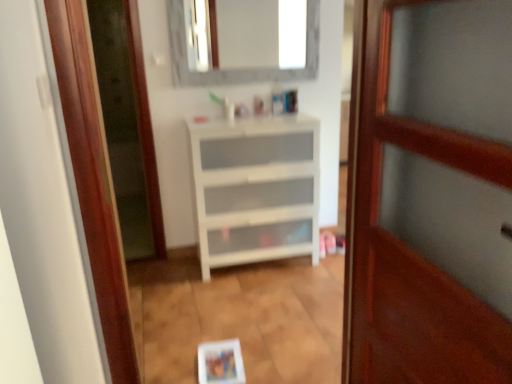
Question: Is white marble mirror at upper center bigger than wooden door at center?

Choices:
 (A) no
 (B) yes

Answer: (A)

Question: Does white marble mirror at upper center have a smaller size compared to wooden door at center?

Choices:
 (A) yes
 (B) no

Answer: (A)

Question: Is white marble mirror at upper center far away from wooden door at center?

Choices:
 (A) yes
 (B) no

Answer: (A)

Question: Considering the relative positions of white marble mirror at upper center and wooden door at center in the image provided, is white marble mirror at upper center to the right of wooden door at center from the viewer's perspective?

Choices:
 (A) no
 (B) yes

Answer: (A)

Question: Is white marble mirror at upper center in front of wooden door at center?

Choices:
 (A) yes
 (B) no

Answer: (B)

Question: From the image's perspective, is white matte chest of drawers at center located above or below wooden door at center?

Choices:
 (A) above
 (B) below

Answer: (A)

Question: From a real-world perspective, is white matte chest of drawers at center above or below wooden door at center?

Choices:
 (A) above
 (B) below

Answer: (B)

Question: Is white matte chest of drawers at center inside the boundaries of wooden door at center, or outside?

Choices:
 (A) outside
 (B) inside

Answer: (A)

Question: Is white matte chest of drawers at center in front of or behind wooden door at center in the image?

Choices:
 (A) behind
 (B) front

Answer: (A)

Question: Is white marble mirror at upper center in front of or behind wooden door at center in the image?

Choices:
 (A) behind
 (B) front

Answer: (A)

Question: Is white marble mirror at upper center wider or thinner than wooden door at center?

Choices:
 (A) wide
 (B) thin

Answer: (B)

Question: Is white marble mirror at upper center situated inside wooden door at center or outside?

Choices:
 (A) inside
 (B) outside

Answer: (B)

Question: From the image's perspective, is white marble mirror at upper center positioned above or below wooden door at center?

Choices:
 (A) above
 (B) below

Answer: (A)

Question: Looking at their shapes, would you say wooden door at center is wider or thinner than white matte chest of drawers at center?

Choices:
 (A) wide
 (B) thin

Answer: (B)

Question: Is point (423, 284) closer or farther from the camera than point (249, 223)?

Choices:
 (A) closer
 (B) farther

Answer: (A)